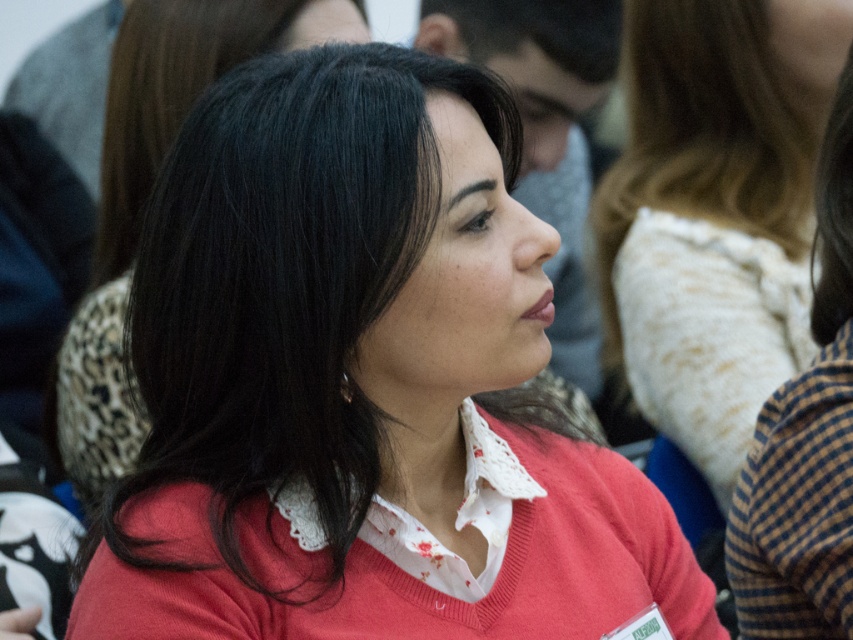
Question: Can you confirm if matte red sweater at center is positioned above black silky hair at upper right?

Choices:
 (A) no
 (B) yes

Answer: (A)

Question: Is black smooth hair at center positioned before black silky hair at upper right?

Choices:
 (A) no
 (B) yes

Answer: (A)

Question: Which object appears farthest from the camera in this image?

Choices:
 (A) matte red sweater at center
 (B) black smooth hair at center
 (C) white lace shirt at center

Answer: (C)

Question: Which point appears farthest from the camera in this image?

Choices:
 (A) (846, 301)
 (B) (660, 348)
 (C) (825, 305)
 (D) (167, 58)

Answer: (B)

Question: Does matte red sweater at center appear on the left side of black silky hair at upper right?

Choices:
 (A) no
 (B) yes

Answer: (B)

Question: Which of the following is the closest to the observer?

Choices:
 (A) blue checkered shirt at right
 (B) matte red sweater at center
 (C) white lace shirt at center
 (D) black smooth hair at center

Answer: (B)